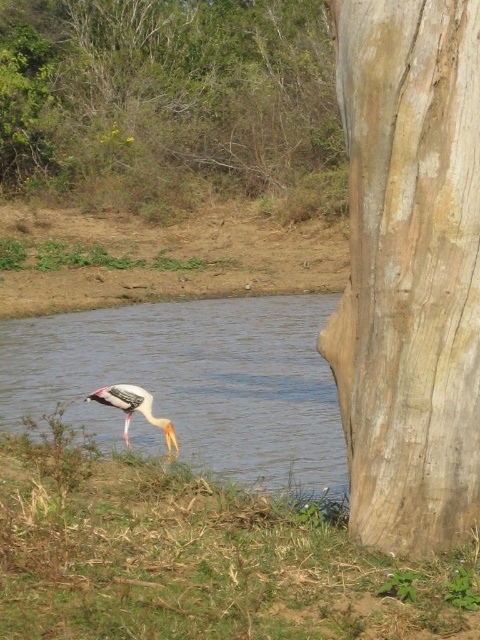
Question: Which of the following is the closest to the observer?

Choices:
 (A) painted wood stork at lower left
 (B) green grass at lower left

Answer: (B)

Question: Does light brown rough bark at right lie in front of smooth brown water at lower left?

Choices:
 (A) yes
 (B) no

Answer: (A)

Question: Can you confirm if green grass at lower left is wider than brown rough tree at upper left?

Choices:
 (A) no
 (B) yes

Answer: (A)

Question: Which of the following is the farthest from the observer?

Choices:
 (A) (96, 392)
 (B) (384, 561)
 (C) (176, 28)

Answer: (C)

Question: Based on their relative distances, which object is nearer to the light brown rough bark at right?

Choices:
 (A) brown rough tree at upper left
 (B) green grass at lower left
 (C) painted wood stork at lower left

Answer: (B)

Question: Is the position of green grass at lower left more distant than that of smooth brown water at lower left?

Choices:
 (A) no
 (B) yes

Answer: (A)